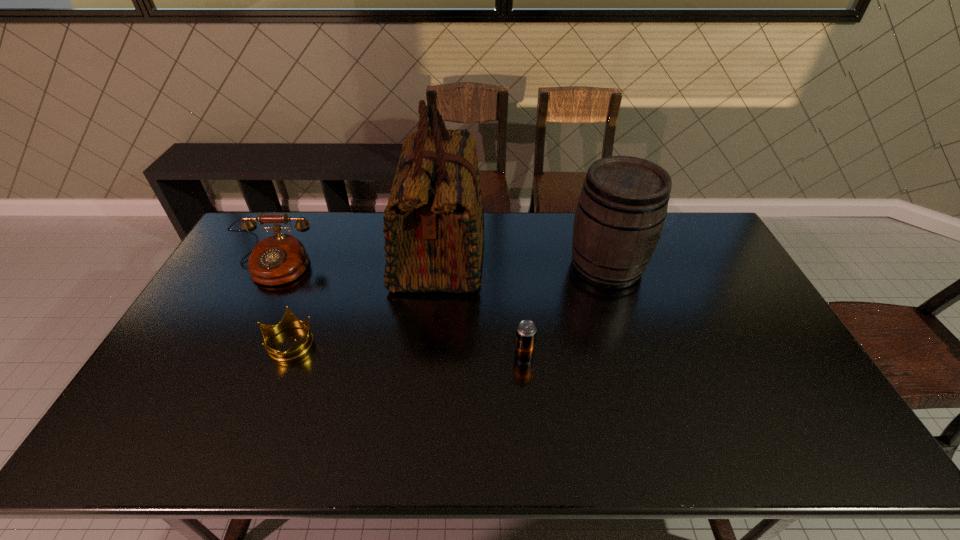
Locate an element on the screen. free spot that satisfies the following two spatial constraints: 1. on the back side of the beer can; 2. on the open handle side of the tallest object is located at coordinates (515, 252).

This screenshot has width=960, height=540. I want to click on vacant space that satisfies the following two spatial constraints: 1. on the dial of the telephone; 2. on the left side of the beer can, so click(228, 356).

The width and height of the screenshot is (960, 540). Find the location of `vacant space that satisfies the following two spatial constraints: 1. on the open handle side of the shopping bag; 2. on the front side of the shortest object`. vacant space that satisfies the following two spatial constraints: 1. on the open handle side of the shopping bag; 2. on the front side of the shortest object is located at coordinates (431, 342).

Image resolution: width=960 pixels, height=540 pixels. I want to click on free region that satisfies the following two spatial constraints: 1. on the open handle side of the second object from right to left; 2. on the right side of the shopping bag, so click(x=429, y=356).